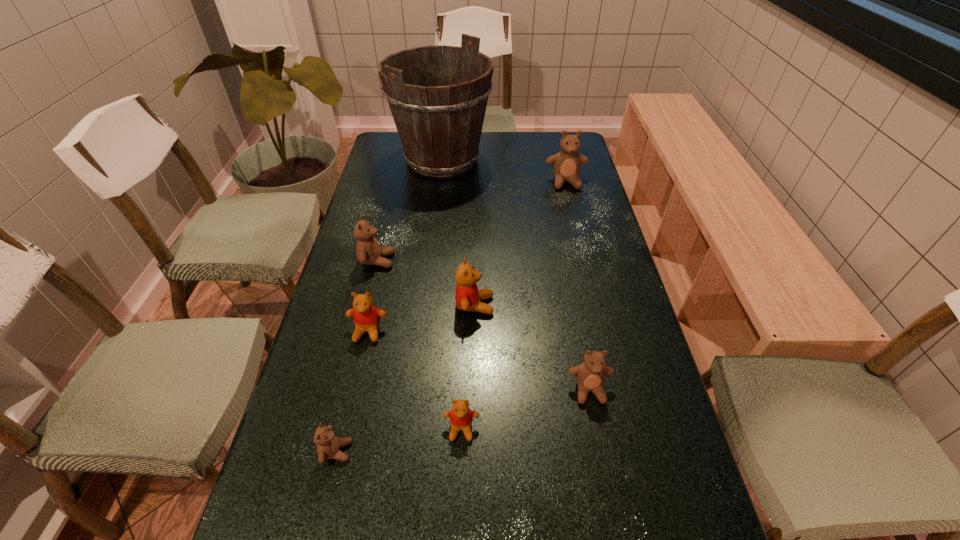
The height and width of the screenshot is (540, 960). Find the location of `the smallest red teddy bear`. the smallest red teddy bear is located at coordinates (461, 417).

I want to click on free point located 0.240m on the right of the tallest object, so [556, 159].

At what (x,y) coordinates should I click in order to perform the action: click on free space located on the front-facing side of the farthest brown teddy bear. Please return your answer as a coordinate pair (x, y). This screenshot has width=960, height=540. Looking at the image, I should click on (579, 234).

This screenshot has height=540, width=960. I want to click on free location located 0.180m on the front-facing side of the sixth nearest object, so click(457, 260).

I want to click on free region located 0.300m on the front-facing side of the biggest red teddy bear, so click(x=609, y=305).

Image resolution: width=960 pixels, height=540 pixels. What are the coordinates of `free space located on the front-facing side of the leftmost red teddy bear` in the screenshot? It's located at (324, 528).

You are a GUI agent. You are given a task and a screenshot of the screen. Output one action in this format:
    pyautogui.click(x=<x>, y=<y>)
    Task: Click on the vacant space located on the front-facing side of the third biggest brown teddy bear
    The image size is (960, 540).
    Given the screenshot: What is the action you would take?
    [604, 462]

You are a GUI agent. You are given a task and a screenshot of the screen. Output one action in this format:
    pyautogui.click(x=<x>, y=<y>)
    Task: Click on the vacant space situated on the front-facing side of the nearest brown teddy bear
    The image size is (960, 540).
    Given the screenshot: What is the action you would take?
    pyautogui.click(x=522, y=451)

At what (x,y) coordinates should I click in order to perform the action: click on vacant region located 0.070m on the front-facing side of the nearest red teddy bear. Please return your answer as a coordinate pair (x, y). This screenshot has width=960, height=540. Looking at the image, I should click on (460, 478).

This screenshot has width=960, height=540. In order to click on object situated at the far edge in this screenshot , I will do `click(439, 123)`.